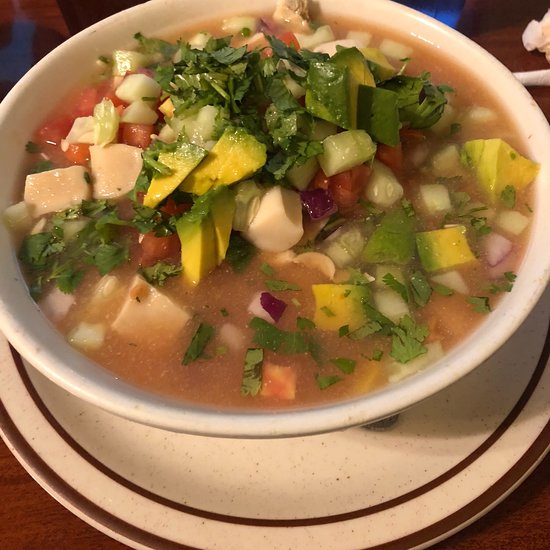
What are the coordinates of `table` in the screenshot? It's located at (520, 513).